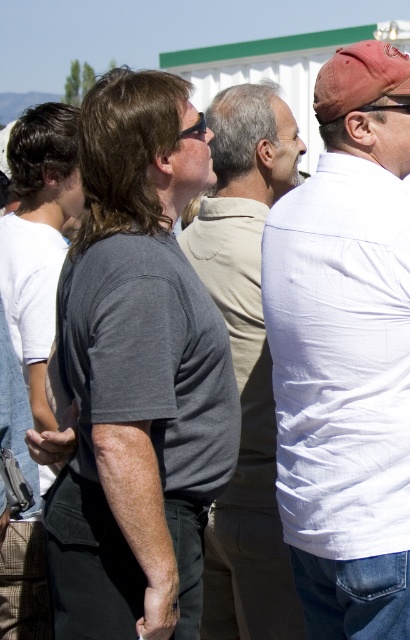
You are a photographer at the event and want to capture a photo that includes both the white cotton shirt at right and the gray cotton shirt at center. Since you want both shirts to be fully visible in the frame, which person should you position closer to the camera?

The white cotton shirt at right is shorter than the gray cotton shirt at center, so you should position the white cotton shirt at right closer to the camera to ensure both are fully visible.

You are taking a photo of the gray cotton shirt at center and the white cotton shirt at right. Which one should you focus on first to ensure both are in focus?

You should focus on the white cotton shirt at right first because it is closer to the viewer than the gray cotton shirt at center, so adjusting focus from near to far will help both be in focus.

Based on the coordinates provided, where is the white cotton shirt at right located in the image?

The white cotton shirt at right is located at the coordinates point [346,352].